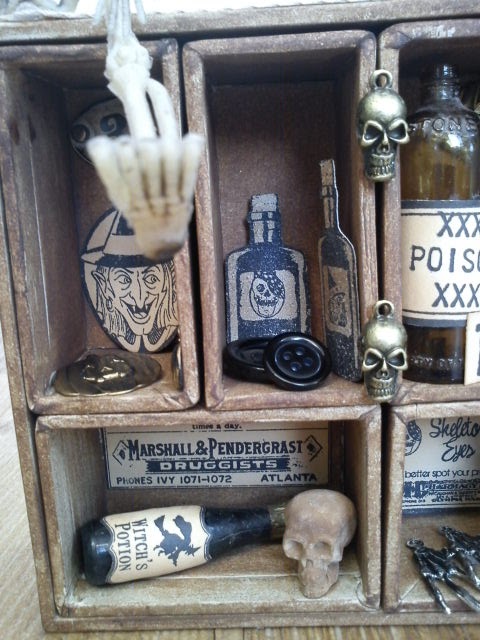
Identify the location of green glass bottle. The image size is (480, 640). coord(423,177).